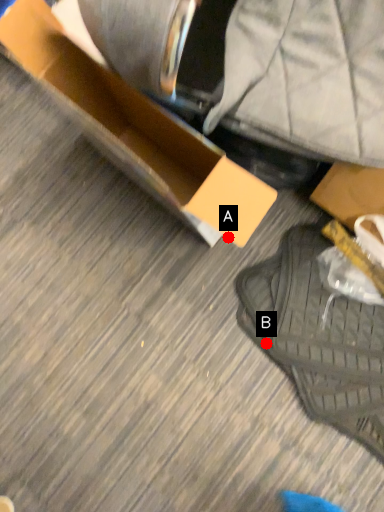
Question: Two points are circled on the image, labeled by A and B beside each circle. Which point is farther from the camera taking this photo?

Choices:
 (A) A is further
 (B) B is further

Answer: (B)